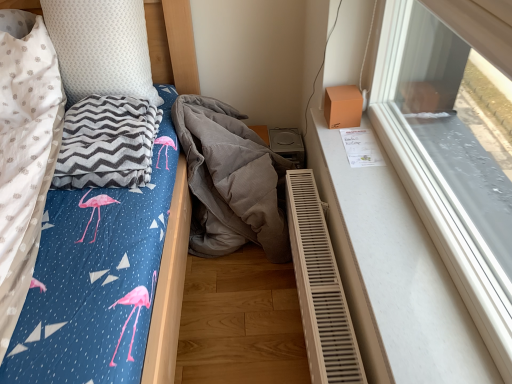
Where is `free area below transparent glass window at upper right (from a real-world perspective)`? This screenshot has width=512, height=384. free area below transparent glass window at upper right (from a real-world perspective) is located at coordinates coord(401,216).